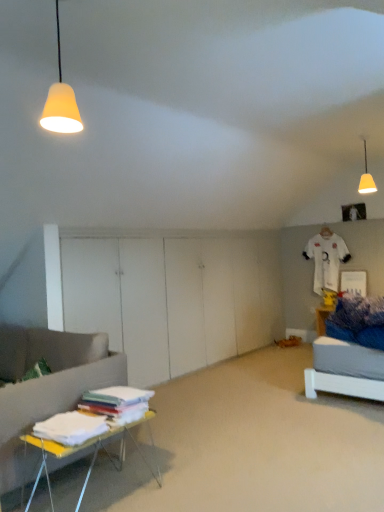
Question: In the image, is matte yellow lampshade at upper right, the second lamp viewed from the front, positioned in front of or behind white cotton sheets at lower left?

Choices:
 (A) behind
 (B) front

Answer: (A)

Question: From their relative heights in the image, would you say matte yellow lampshade at upper right, the second lamp viewed from the front, is taller or shorter than white cotton sheets at lower left?

Choices:
 (A) short
 (B) tall

Answer: (B)

Question: Which is nearer to the matte yellow lampshade at upper right, acting as the second lamp starting from the left?

Choices:
 (A) matte yellow cone at upper left, the 1th lamp viewed from the left
 (B) white plastic table at lower left
 (C) white fabric stack at lower left
 (D) white cotton sheets at lower left

Answer: (C)

Question: Which object is positioned farthest from the white plastic table at lower left?

Choices:
 (A) white cotton sheets at lower left
 (B) white fabric stack at lower left
 (C) matte yellow cone at upper left, the 1th lamp viewed from the left
 (D) matte yellow lampshade at upper right, acting as the second lamp starting from the left

Answer: (D)